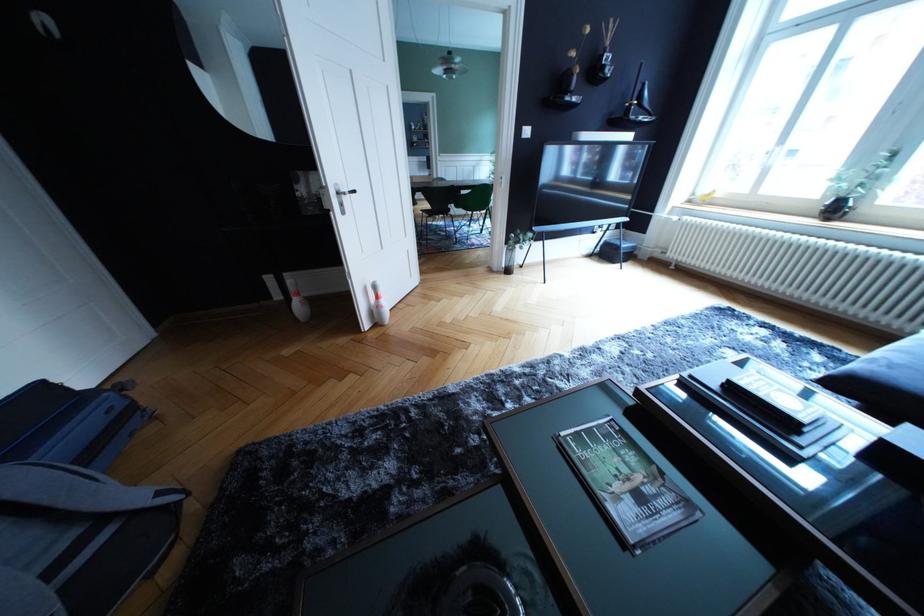
The height and width of the screenshot is (616, 924). In order to click on white light switch in this screenshot , I will do `click(526, 132)`.